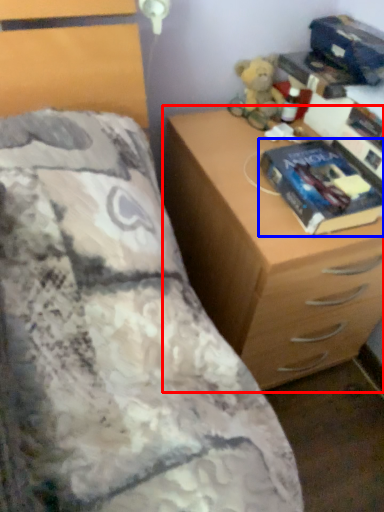
Question: Which point is further to the camera, chest of drawers (highlighted by a red box) or paperback book (highlighted by a blue box)?

Choices:
 (A) chest of drawers
 (B) paperback book

Answer: (B)